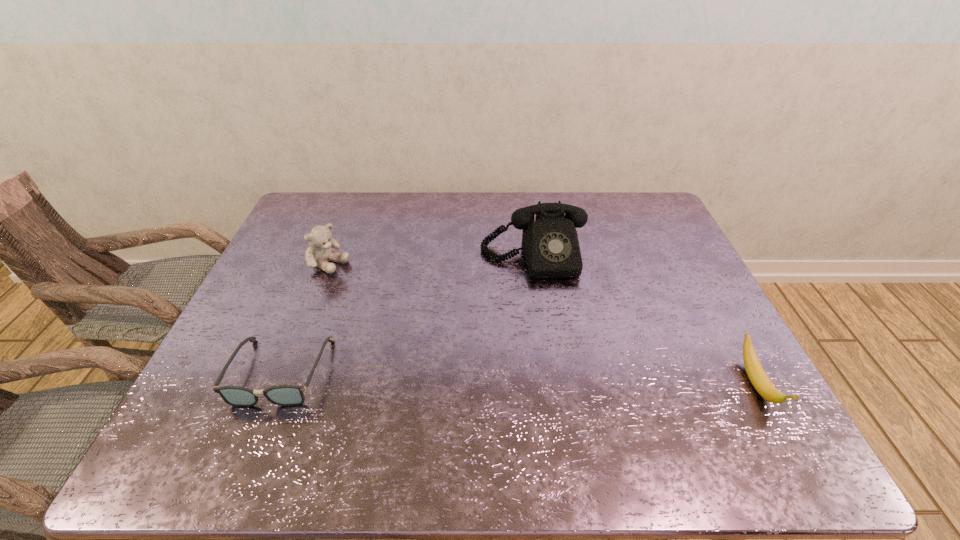
The height and width of the screenshot is (540, 960). Identify the location of vacant space located 0.320m on the face of the teddy bear. (x=428, y=316).

Where is `spectacles that is at the near edge`? spectacles that is at the near edge is located at coordinates (284, 395).

Find the location of a particular element. Image resolution: width=960 pixels, height=540 pixels. banana at the near edge is located at coordinates (756, 374).

Image resolution: width=960 pixels, height=540 pixels. What are the coordinates of `spectacles present at the left edge` in the screenshot? It's located at click(x=284, y=395).

Find the location of `teddy bear located at the left edge`. teddy bear located at the left edge is located at coordinates (319, 252).

This screenshot has width=960, height=540. Identify the location of object positioned at the right edge. (756, 374).

Image resolution: width=960 pixels, height=540 pixels. In order to click on object located in the near left corner section of the desktop in this screenshot , I will do `click(284, 395)`.

I want to click on object at the near right corner, so click(756, 374).

This screenshot has height=540, width=960. I want to click on vacant space at the far edge of the desktop, so click(529, 200).

Find the location of a particular element. vacant space at the near edge of the desktop is located at coordinates (536, 385).